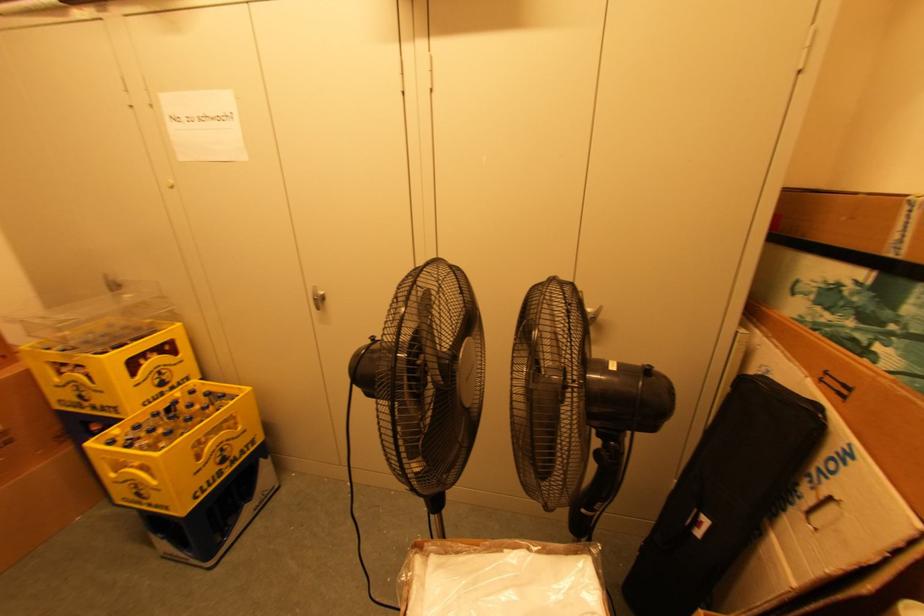
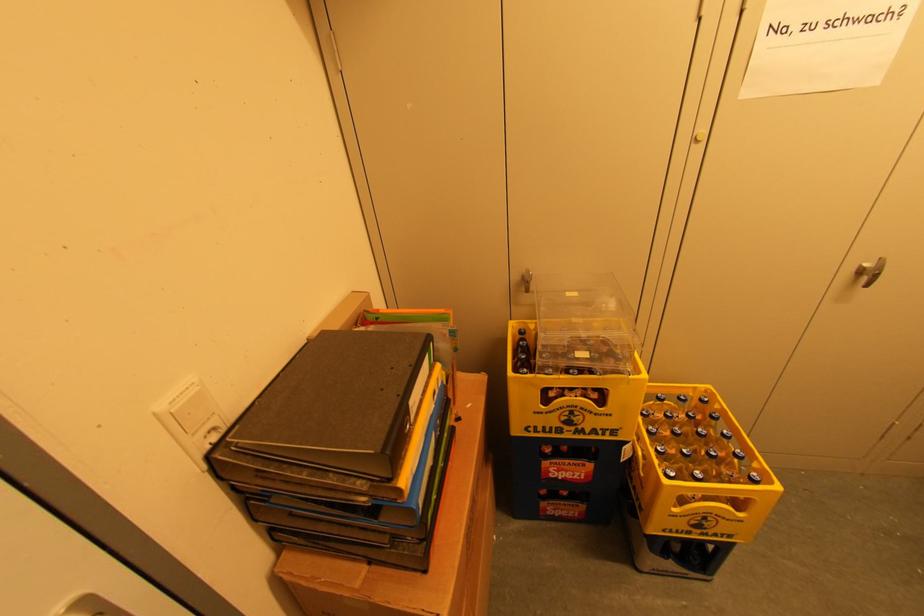
In the second image, find the point that corresponds to point (322, 302) in the first image.

(869, 275)